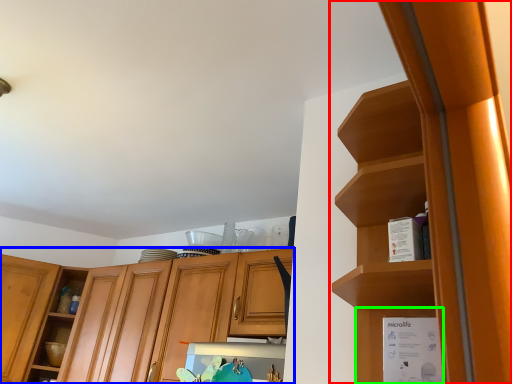
Question: Which is nearer to the cabinetry (highlighted by a red box)? cabinetry (highlighted by a blue box) or cabinet (highlighted by a green box).

Choices:
 (A) cabinetry
 (B) cabinet

Answer: (B)